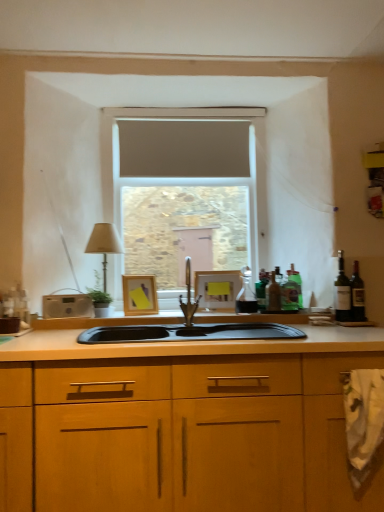
Question: Considering the positions of point (291, 305) and point (187, 294), is point (291, 305) closer or farther from the camera than point (187, 294)?

Choices:
 (A) farther
 (B) closer

Answer: (B)

Question: Is green glass bottle at right, acting as the third bottle starting from the left, bigger or smaller than polished stainless steel faucet at center?

Choices:
 (A) small
 (B) big

Answer: (A)

Question: Considering the real-world distances, which object is closest to the matte gray screen at center?

Choices:
 (A) dark glass bottle at right, the second wine bottle from the left
 (B) matte wooden picture frame at center, the 2th picture frame positioned from the left
 (C) translucent glass bottle at right, placed as the second bottle when sorted from left to right
 (D) polished stainless steel faucet at center
 (E) beige fabric lampshade at left

Answer: (E)

Question: Considering the real-world distances, which object is closest to the green glass bottle at right, acting as the second bottle starting from the right?

Choices:
 (A) green glass bottle at right, which ranks as the fourth bottle in left-to-right order
 (B) beige fabric lampshade at left
 (C) translucent glass bottle at right, which is the third bottle from right to left
 (D) matte wooden picture frame at center, arranged as the first picture frame when viewed from the right
 (E) translucent glass carafe at center, which is counted as the 1th bottle, starting from the left

Answer: (C)